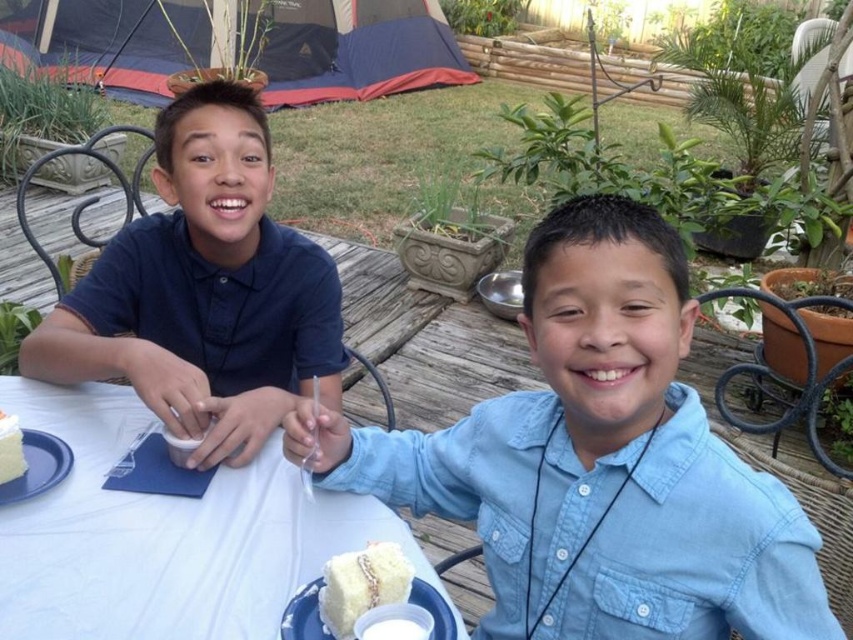
You are a photographer trying to capture a closeup shot of both the white matte plate at lower center and the white fluffy cake at lower left. Since you can only focus on one object at a time, which one should you choose to ensure the subject is in focus and fills the frame adequately?

The white fluffy cake at lower left has a greater height than the white matte plate at lower center, so focusing on the white fluffy cake at lower left will allow it to fill the frame more effectively while maintaining focus.

You are a photographer trying to capture a closeup of the light blue denim shirt at center. Based on the coordinates provided, where should you position your camera relative to the boys?

The light blue denim shirt at center is located at point 0.722 on the x axis and 0.701 on the y axis, so you should position your camera slightly to the right and below the center of the image to capture it.

You are standing at the camera position and want to reach the point at coordinates (x=451, y=625). If your arm can extend 30 inches, can you reach it?

The point at coordinates (x=451, y=625) is 33.90 inches away from the camera, which is beyond your arm reach of 30 inches. You cannot reach it.